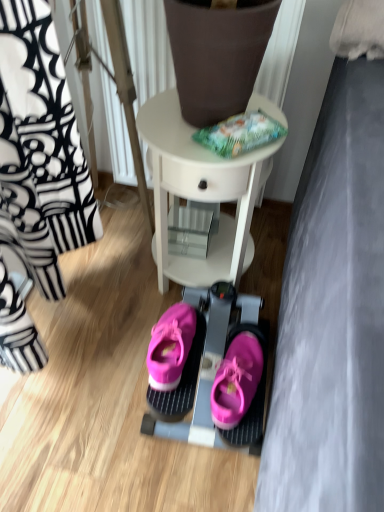
I want to click on vacant area that lies to the right of pink suede sneakers at center, so click(x=231, y=344).